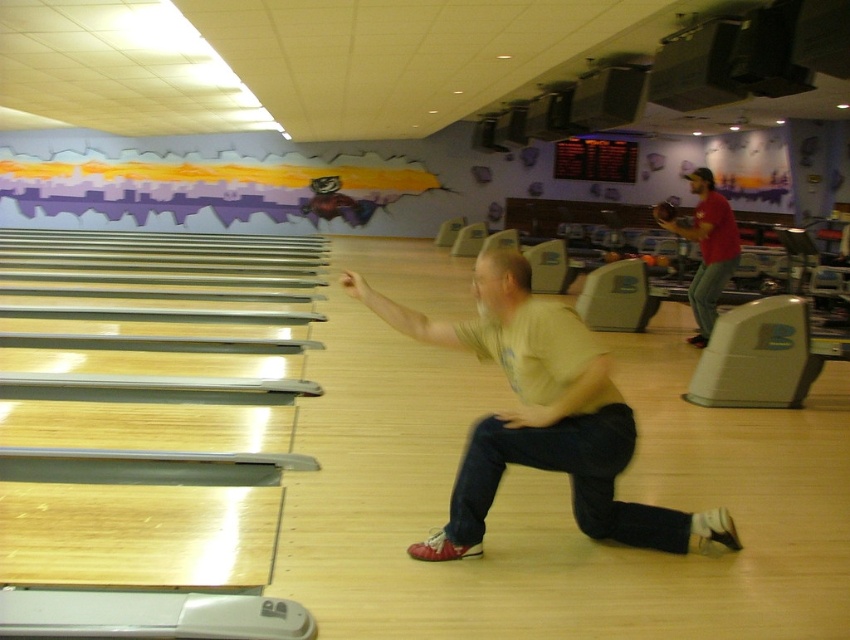
You are standing at the bowling alley and want to roll the ball towards the pins. There are two points marked on the lane at coordinates point (627, 449) and point (690, 179). Which point should you aim for to ensure the ball reaches the pins first?

You should aim for point (627, 449) because it is in front of point (690, 179), so the ball will reach it first.

You are standing at the camera position and want to pick up an object located at point (547,344). Can you reach it without moving your feet?

The point (547,344) is 2.54 meters away from the camera, so you cannot reach it without moving your feet since it is beyond arm length.